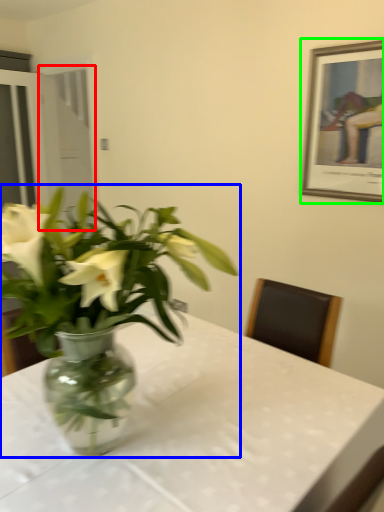
Question: Which is nearer to the glass door (highlighted by a red box)? houseplant (highlighted by a blue box) or picture frame (highlighted by a green box).

Choices:
 (A) houseplant
 (B) picture frame

Answer: (B)